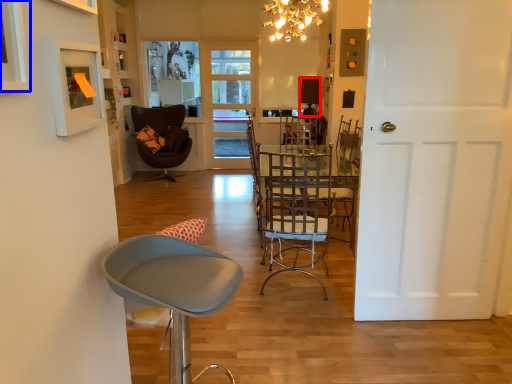
Question: Which object is closer to the camera taking this photo, lamp (highlighted by a red box) or picture frame (highlighted by a blue box)?

Choices:
 (A) lamp
 (B) picture frame

Answer: (B)